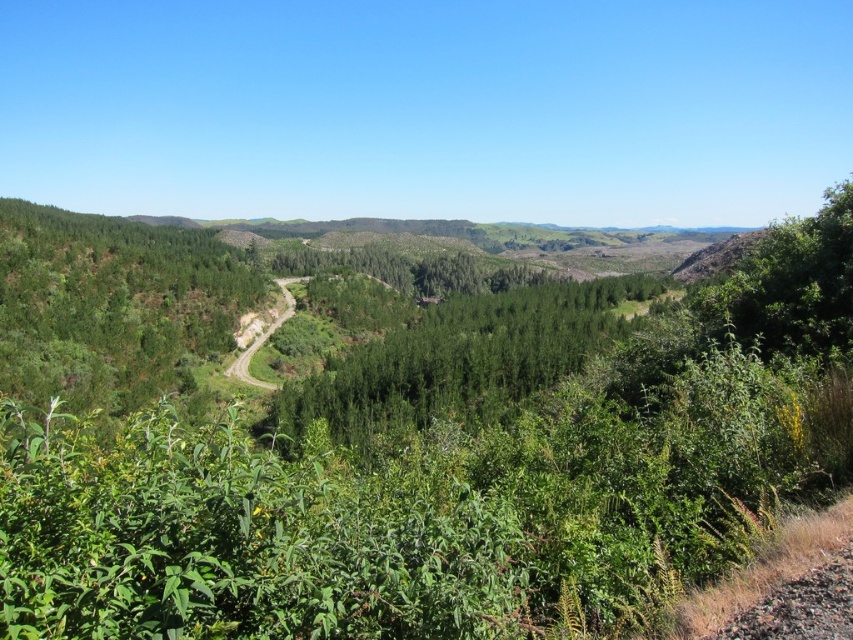
Between green leafy shrub at right and brown gravel dirt track at lower right, which one has less height?

brown gravel dirt track at lower right

Identify the location of green leafy shrub at right. (790, 285).

This screenshot has width=853, height=640. I want to click on green leafy shrub at right, so click(790, 285).

Find the location of `green leafy shrub at right`. green leafy shrub at right is located at coordinates (790, 285).

Is green leafy tree at left above brown gravel dirt track at lower right?

Correct, green leafy tree at left is located above brown gravel dirt track at lower right.

In the scene shown: Does green leafy tree at left have a lesser height compared to brown gravel dirt track at lower right?

No, green leafy tree at left is not shorter than brown gravel dirt track at lower right.

The image size is (853, 640). I want to click on green leafy tree at left, so click(112, 305).

Is green leafy trees at center positioned before dirt/path at center-left?

Yes, it is.

Between point (393, 413) and point (289, 304), which one is positioned in front?

Positioned in front is point (393, 413).

Who is more forward, (422, 364) or (291, 278)?

Point (422, 364)

This screenshot has height=640, width=853. I want to click on green leafy trees at center, so (x=461, y=358).